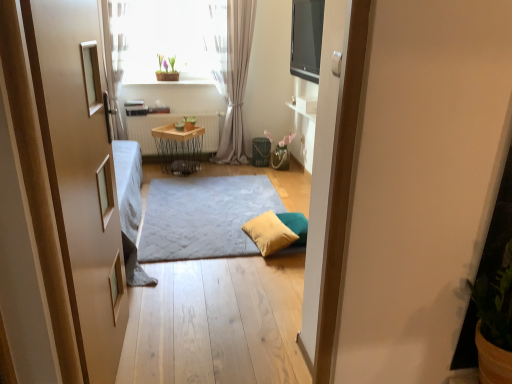
Locate an element on the screen. vacant point to the right of wooden door at left is located at coordinates (219, 349).